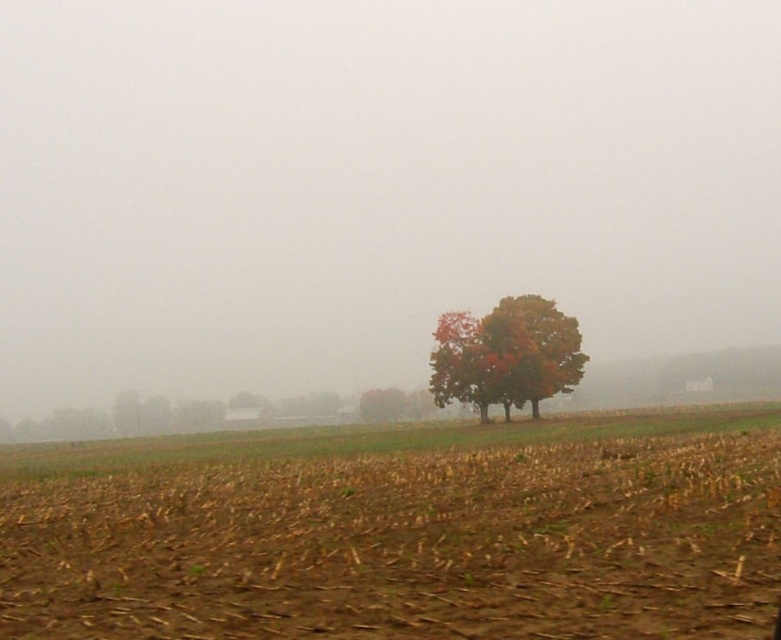
Question: Does brown soil at lower center appear over autumn leaves tree at center?

Choices:
 (A) yes
 (B) no

Answer: (B)

Question: Which of the following is the closest to the observer?

Choices:
 (A) (430, 518)
 (B) (569, 369)

Answer: (A)

Question: Is brown soil at lower center in front of autumn leaves tree at center?

Choices:
 (A) no
 (B) yes

Answer: (B)

Question: Can you confirm if brown soil at lower center is positioned to the right of autumn leaves tree at center?

Choices:
 (A) yes
 (B) no

Answer: (B)

Question: Which point is farther to the camera?

Choices:
 (A) (282, 582)
 (B) (551, 317)

Answer: (B)